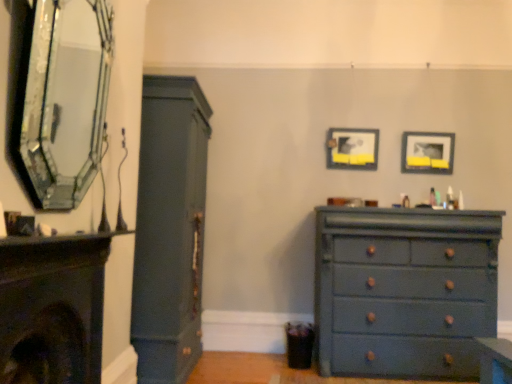
Find the location of a particular element. vacant region above matte black picture frame at upper center, the 1th picture frame viewed from the left (from a real-world perspective) is located at coordinates (355, 123).